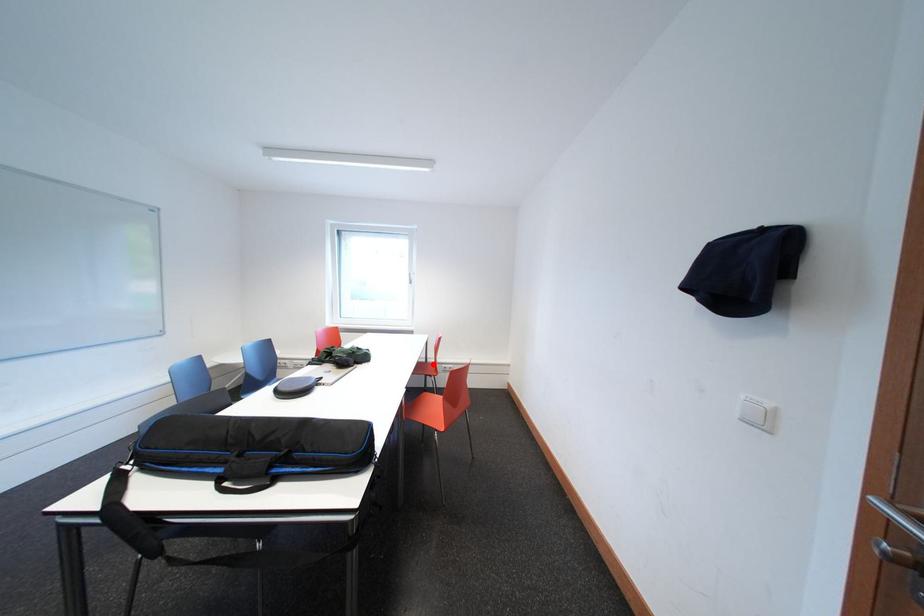
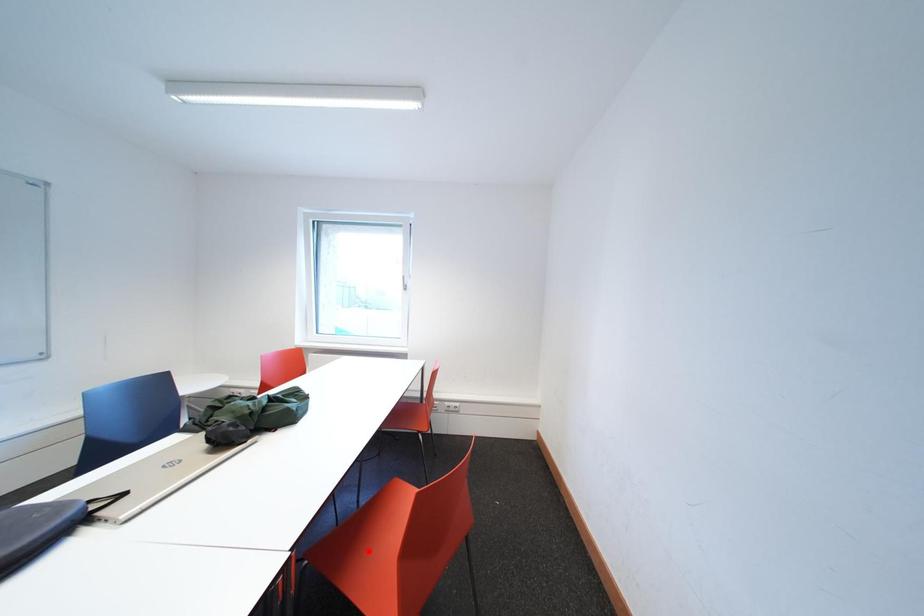
I am providing you with two images of the same scene from different viewpoints. A red point is marked on the first image and another point is marked on the second image. Do the highlighted points in image1 and image2 indicate the same real-world spot?

No